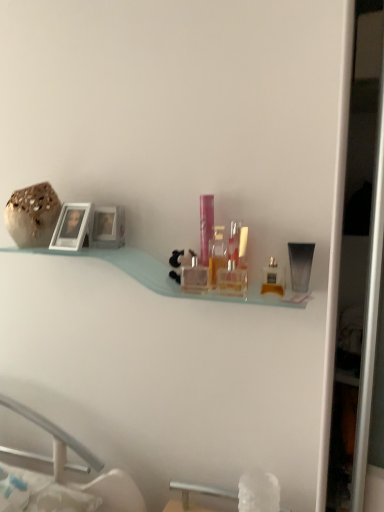
In order to face clear plastic perfume bottle at center, arranged as the fifth toiletry when viewed from the left, should I rotate leftwards or rightwards?

Turn right by 5.839 degrees to look at clear plastic perfume bottle at center, arranged as the fifth toiletry when viewed from the left.

Find the location of a particular element. The image size is (384, 512). clear plastic perfume bottle at center, arranged as the fifth toiletry when viewed from the left is located at coordinates (234, 241).

Describe the element at coordinates (72, 227) in the screenshot. I see `matte silver picture frame at left` at that location.

From the picture: What is the approximate width of matte silver picture frame at left?

It is 9.62 centimeters.

Describe the element at coordinates (232, 280) in the screenshot. I see `clear glass perfume bottle at center, which is the fifth toiletry from right to left` at that location.

The height and width of the screenshot is (512, 384). Identify the location of translucent glass perfume bottle at center, the third toiletry positioned from the left. point(217,253).

Locate an element on the screen. speckled ceramic vase at upper left is located at coordinates (32, 215).

Is clear glass perfume bottle at center, the eighth toiletry in the right-to-left sequence, at the back of matte silver picture frame at left?

No.

Between matte silver picture frame at left and clear glass perfume bottle at center, the first toiletry viewed from the left, which one is positioned behind?

matte silver picture frame at left is more distant.

From a real-world perspective, which object rests below the other?

From a 3D spatial view, clear glass perfume bottle at center, the eighth toiletry in the right-to-left sequence, is below.

Are matte silver picture frame at left and clear glass perfume bottle at center, the first toiletry viewed from the left, located far from each other?

matte silver picture frame at left is near clear glass perfume bottle at center, the first toiletry viewed from the left, not far away.

From a real-world perspective, which object rests below the other?

transparent plastic tube at right, the first toiletry when ordered from right to left, is physically lower.

Does point (209, 209) come behind point (294, 263)?

Yes.

Can you confirm if pink plastic container at center, which is the 2th toiletry in left-to-right order, is shorter than clear glass perfume bottle at center, the eighth toiletry in the right-to-left sequence?

No.

Does point (210, 228) come closer to viewer compared to point (201, 290)?

No, (210, 228) is further to viewer.

Is pink plastic container at center, which is the seventh toiletry from right to left, positioned beyond the bounds of clear glass perfume bottle at center, the eighth toiletry in the right-to-left sequence?

Yes, pink plastic container at center, which is the seventh toiletry from right to left, is not within clear glass perfume bottle at center, the eighth toiletry in the right-to-left sequence.

From a real-world perspective, is pink plastic container at center, which is the 2th toiletry in left-to-right order, located beneath clear glass perfume bottle at center, the first toiletry viewed from the left?

No, from a real-world perspective, pink plastic container at center, which is the 2th toiletry in left-to-right order, is not under clear glass perfume bottle at center, the first toiletry viewed from the left.

Is translucent glass perfume bottle at center, arranged as the 6th toiletry when viewed from the right, bigger or smaller than matte silver picture frame at left?

In the image, translucent glass perfume bottle at center, arranged as the 6th toiletry when viewed from the right, appears to be smaller than matte silver picture frame at left.

Could you measure the distance between translucent glass perfume bottle at center, arranged as the 6th toiletry when viewed from the right, and matte silver picture frame at left?

A distance of 18.66 inches exists between translucent glass perfume bottle at center, arranged as the 6th toiletry when viewed from the right, and matte silver picture frame at left.

From the image's perspective, is translucent glass perfume bottle at center, arranged as the 6th toiletry when viewed from the right, positioned above or below matte silver picture frame at left?

Based on their image positions, translucent glass perfume bottle at center, arranged as the 6th toiletry when viewed from the right, is located beneath matte silver picture frame at left.

I want to click on picture frame behind the translucent glass perfume bottle at center, arranged as the 6th toiletry when viewed from the right, so click(72, 227).

Considering the points (73, 233) and (205, 250), which point is behind, point (73, 233) or point (205, 250)?

The point (73, 233) is more distant.

Is matte silver picture frame at left positioned beyond the bounds of pink plastic container at center, which is the 2th toiletry in left-to-right order?

matte silver picture frame at left is positioned outside pink plastic container at center, which is the 2th toiletry in left-to-right order.

Is matte silver picture frame at left looking in the opposite direction of pink plastic container at center, which is the 2th toiletry in left-to-right order?

No, matte silver picture frame at left is not facing the opposite direction of pink plastic container at center, which is the 2th toiletry in left-to-right order.

Which of these two, matte silver picture frame at left or pink plastic container at center, which is the 2th toiletry in left-to-right order, is smaller?

Smaller between the two is pink plastic container at center, which is the 2th toiletry in left-to-right order.

Does clear glass perfume bottle at center, which is the fifth toiletry from right to left, have a larger size compared to transparent plastic tube at right, which appears as the 8th toiletry when viewed from the left?

No.

From a real-world perspective, is clear glass perfume bottle at center, which is the 4th toiletry in left-to-right order, beneath transparent plastic tube at right, the first toiletry when ordered from right to left?

Yes, from a real-world perspective, clear glass perfume bottle at center, which is the 4th toiletry in left-to-right order, is below transparent plastic tube at right, the first toiletry when ordered from right to left.

From the image's perspective, would you say clear glass perfume bottle at center, which is the fifth toiletry from right to left, is shown under transparent plastic tube at right, the first toiletry when ordered from right to left?

Indeed, from the image's perspective, clear glass perfume bottle at center, which is the fifth toiletry from right to left, is shown beneath transparent plastic tube at right, the first toiletry when ordered from right to left.

Is matte silver picture frame at left bigger or smaller than clear plastic perfume bottle at center, arranged as the fifth toiletry when viewed from the left?

matte silver picture frame at left is bigger than clear plastic perfume bottle at center, arranged as the fifth toiletry when viewed from the left.

Is clear plastic perfume bottle at center, arranged as the fifth toiletry when viewed from the left, a part of matte silver picture frame at left?

No, clear plastic perfume bottle at center, arranged as the fifth toiletry when viewed from the left, is not inside matte silver picture frame at left.

Is matte silver picture frame at left turned away from clear plastic perfume bottle at center, the 4th toiletry positioned from the right?

matte silver picture frame at left does not have its back to clear plastic perfume bottle at center, the 4th toiletry positioned from the right.

How different are the orientations of matte silver picture frame at left and clear plastic perfume bottle at center, arranged as the fifth toiletry when viewed from the left, in degrees?

They differ by 9.68 degrees in their facing directions.

From a real-world perspective, count 7th toiletrys downward from the matte silver picture frame at left and point to it. Please provide its 2D coordinates.

[(194, 277)]

There is a pink plastic container at center, which is the 2th toiletry in left-to-right order. Where is `the 4th toiletry below it (from the image's perspective)`? the 4th toiletry below it (from the image's perspective) is located at coordinates (300, 265).

Which object lies further to the anchor point matte silver picture frame at left, translucent plastic bottle at center, acting as the seventh toiletry starting from the left, or clear glass perfume bottle at center, which is the 4th toiletry in left-to-right order?

translucent plastic bottle at center, acting as the seventh toiletry starting from the left, is positioned further to the anchor matte silver picture frame at left.

Looking at the image, which one is located closer to transparent plastic tube at right, which appears as the 8th toiletry when viewed from the left, pink plastic container at center, which is the seventh toiletry from right to left, or clear plastic perfume bottle at center, the 4th toiletry positioned from the right?

clear plastic perfume bottle at center, the 4th toiletry positioned from the right, is closer to transparent plastic tube at right, which appears as the 8th toiletry when viewed from the left.

Which object lies nearer to the anchor point translucent glass perfume bottle at center, the third toiletry positioned from the left, clear glass perfume bottle at center, which is the 4th toiletry in left-to-right order, or translucent plastic bottle at center, which appears as the 3th toiletry when viewed from the right?

clear glass perfume bottle at center, which is the 4th toiletry in left-to-right order, lies closer to translucent glass perfume bottle at center, the third toiletry positioned from the left, than the other object.

Estimate the real-world distances between objects in this image. Which object is further from translucent plastic bottle at center, placed as the second toiletry when sorted from right to left, speckled ceramic vase at upper left or transparent plastic tube at right, the first toiletry when ordered from right to left?

speckled ceramic vase at upper left is positioned further to the anchor translucent plastic bottle at center, placed as the second toiletry when sorted from right to left.

Estimate the real-world distances between objects in this image. Which object is closer to translucent glass perfume bottle at center, the third toiletry positioned from the left, clear glass perfume bottle at center, the first toiletry viewed from the left, or clear plastic perfume bottle at center, the 4th toiletry positioned from the right?

clear glass perfume bottle at center, the first toiletry viewed from the left, lies closer to translucent glass perfume bottle at center, the third toiletry positioned from the left, than the other object.

From the image, which object appears to be farther from translucent glass perfume bottle at center, the third toiletry positioned from the left, matte silver picture frame at left or pink plastic container at center, which is the 2th toiletry in left-to-right order?

Based on the image, matte silver picture frame at left appears to be further to translucent glass perfume bottle at center, the third toiletry positioned from the left.

Looking at the image, which one is located further to clear glass perfume bottle at center, which is the fifth toiletry from right to left, clear glass perfume bottle at center, the first toiletry viewed from the left, or matte silver picture frame at left?

Among the two, matte silver picture frame at left is located further to clear glass perfume bottle at center, which is the fifth toiletry from right to left.

Looking at the image, which one is located further to clear glass perfume bottle at center, which is the fifth toiletry from right to left, pink plastic container at center, which is the seventh toiletry from right to left, or translucent plastic bottle at center, which appears as the 3th toiletry when viewed from the right?

pink plastic container at center, which is the seventh toiletry from right to left, lies further to clear glass perfume bottle at center, which is the fifth toiletry from right to left, than the other object.

I want to click on picture frame located between speckled ceramic vase at upper left and transparent plastic tube at right, which appears as the 8th toiletry when viewed from the left, in the left-right direction, so click(72, 227).

You are a GUI agent. You are given a task and a screenshot of the screen. Output one action in this format:
    pyautogui.click(x=<x>, y=<y>)
    Task: Click on the picture frame between speckled ceramic vase at upper left and translucent plastic bottle at center, acting as the seventh toiletry starting from the left, from left to right
    This screenshot has width=384, height=512.
    Given the screenshot: What is the action you would take?
    pyautogui.click(x=72, y=227)

Where is `toiletry between matte silver picture frame at left and pink plastic container at center, which is the seventh toiletry from right to left, in the horizontal direction`? The image size is (384, 512). toiletry between matte silver picture frame at left and pink plastic container at center, which is the seventh toiletry from right to left, in the horizontal direction is located at coordinates (194, 277).

The height and width of the screenshot is (512, 384). In order to click on toiletry between speckled ceramic vase at upper left and pink plastic container at center, which is the 2th toiletry in left-to-right order, in the horizontal direction in this screenshot , I will do `click(194, 277)`.